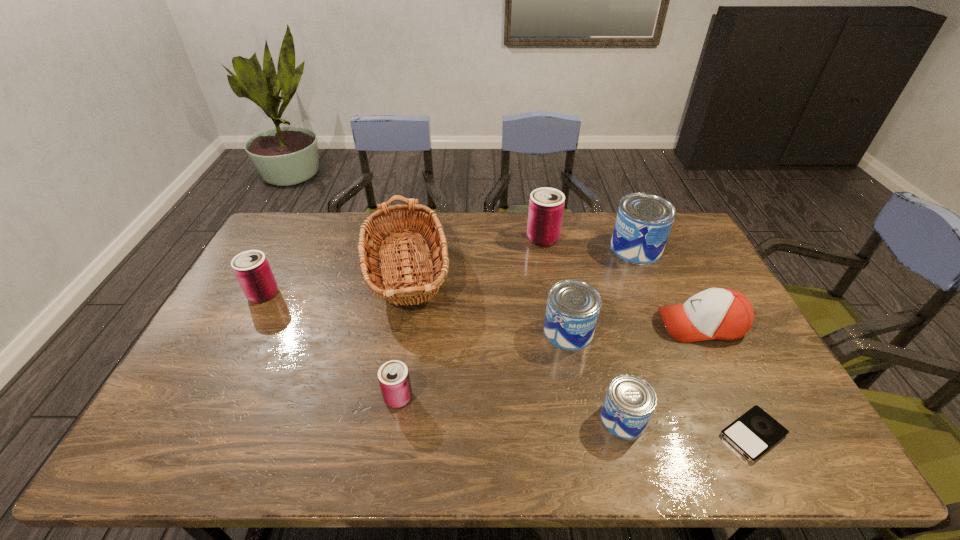
In the image, there is a desktop. Where is `vacant area at the far right corner`? This screenshot has width=960, height=540. vacant area at the far right corner is located at coordinates (691, 235).

Where is `free space between the leftmost can and the baseball cap`? The width and height of the screenshot is (960, 540). free space between the leftmost can and the baseball cap is located at coordinates (482, 309).

I want to click on empty space that is in between the biggest blue can and the nearest blue can, so click(630, 334).

At what (x,y) coordinates should I click in order to perform the action: click on vacant area that lies between the orange baseball cap and the nearest pink can. Please return your answer as a coordinate pair (x, y). Image resolution: width=960 pixels, height=540 pixels. Looking at the image, I should click on (549, 361).

You are a GUI agent. You are given a task and a screenshot of the screen. Output one action in this format:
    pyautogui.click(x=<x>, y=<y>)
    Task: Click on the unoccupied position between the biggest pink can and the rightmost can
    
    Given the screenshot: What is the action you would take?
    (589, 244)

The width and height of the screenshot is (960, 540). Identify the location of free space between the orange baseball cap and the smallest pink can. (549, 361).

You are a GUI agent. You are given a task and a screenshot of the screen. Output one action in this format:
    pyautogui.click(x=<x>, y=<y>)
    Task: Click on the vacant space in between the second nearest blue can and the smallest blue can
    This screenshot has height=540, width=960.
    Given the screenshot: What is the action you would take?
    pyautogui.click(x=595, y=375)

The width and height of the screenshot is (960, 540). Identify the location of free area in between the fourth farthest can and the second pink can from left to right. (483, 364).

Locate an element on the screen. The height and width of the screenshot is (540, 960). vacant point located between the basket and the leftmost can is located at coordinates (336, 282).

Locate an element on the screen. This screenshot has height=540, width=960. free space between the smallest blue can and the basket is located at coordinates (516, 345).